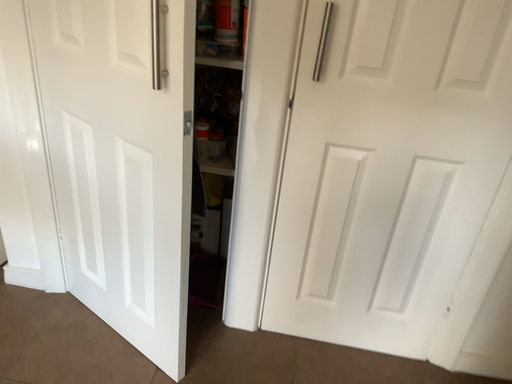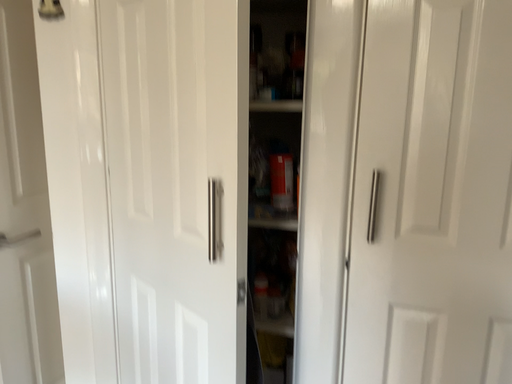
Question: How did the camera likely rotate when shooting the video?

Choices:
 (A) rotated left
 (B) rotated right

Answer: (A)